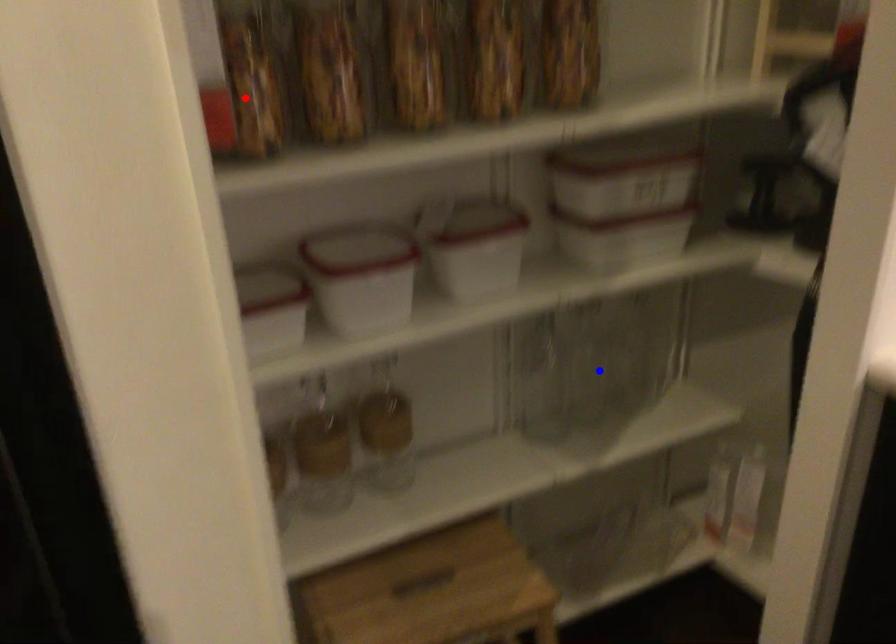
Question: In the image, two points are highlighted. Which point is nearer to the camera? Reply with the corresponding letter.

Choices:
 (A) blue point
 (B) red point

Answer: (B)